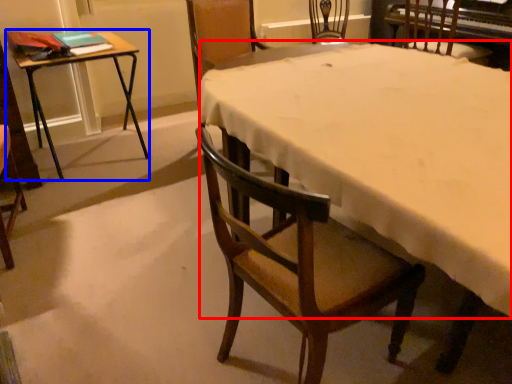
Question: Which object is closer to the camera taking this photo, tablecloth (highlighted by a red box) or table (highlighted by a blue box)?

Choices:
 (A) tablecloth
 (B) table

Answer: (A)